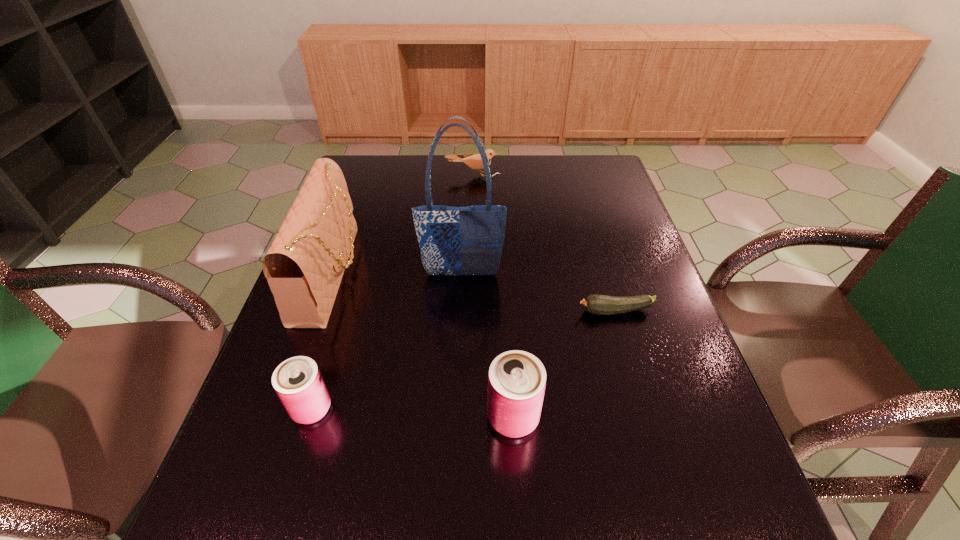
The height and width of the screenshot is (540, 960). Identify the location of free location at the near right corner of the desktop. (729, 469).

Locate an element on the screen. The width and height of the screenshot is (960, 540). vacant area that lies between the right can and the shorter can is located at coordinates (413, 413).

Where is `empty space between the shorter can and the taller can`? The image size is (960, 540). empty space between the shorter can and the taller can is located at coordinates (413, 413).

Locate an element on the screen. vacant space that is in between the second tallest object and the zucchini is located at coordinates (474, 293).

I want to click on free spot between the left can and the farthest object, so click(x=393, y=292).

Identify the location of free space between the fifth shortest object and the shortest object. The width and height of the screenshot is (960, 540). (474, 293).

At what (x,y) coordinates should I click in order to perform the action: click on vacant space that is in between the farthest object and the right can. Please return your answer as a coordinate pair (x, y). This screenshot has height=540, width=960. Looking at the image, I should click on (493, 296).

Identify the location of vacant area between the third shortest object and the shopping bag. This screenshot has width=960, height=540. (387, 342).

I want to click on empty location between the left can and the farthest object, so click(x=393, y=292).

The height and width of the screenshot is (540, 960). In order to click on free area in between the second shortest object and the shortest object in this screenshot , I will do `click(544, 243)`.